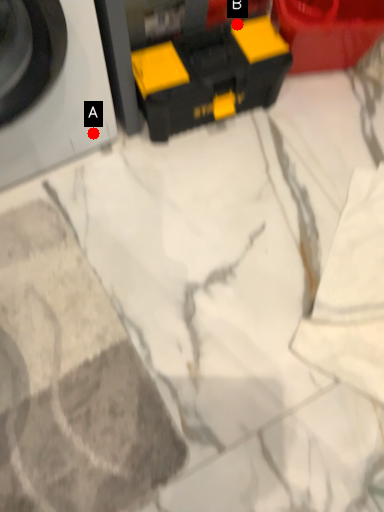
Question: Two points are circled on the image, labeled by A and B beside each circle. Which of the following is the closest to the observer?

Choices:
 (A) A is closer
 (B) B is closer

Answer: (A)